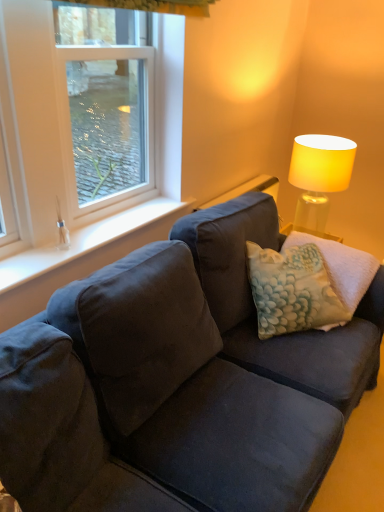
Question: Can you confirm if matte yellow fabric lampshade at upper right is positioned to the right of textured cream pillow at center?

Choices:
 (A) no
 (B) yes

Answer: (B)

Question: Are matte yellow fabric lampshade at upper right and textured cream pillow at center located far from each other?

Choices:
 (A) no
 (B) yes

Answer: (A)

Question: From the image's perspective, is matte yellow fabric lampshade at upper right beneath textured cream pillow at center?

Choices:
 (A) yes
 (B) no

Answer: (B)

Question: Is matte yellow fabric lampshade at upper right in contact with textured cream pillow at center?

Choices:
 (A) no
 (B) yes

Answer: (A)

Question: Does matte yellow fabric lampshade at upper right have a greater width compared to textured cream pillow at center?

Choices:
 (A) no
 (B) yes

Answer: (A)

Question: From the image's perspective, relative to white plastic window at upper left, is silky white curtain at upper center above or below?

Choices:
 (A) below
 (B) above

Answer: (B)

Question: Does point (119, 4) appear closer or farther from the camera than point (124, 212)?

Choices:
 (A) farther
 (B) closer

Answer: (B)

Question: Is silky white curtain at upper center to the left or to the right of white plastic window at upper left in the image?

Choices:
 (A) left
 (B) right

Answer: (B)

Question: From a real-world perspective, is silky white curtain at upper center above or below white plastic window at upper left?

Choices:
 (A) above
 (B) below

Answer: (A)

Question: Is silky white curtain at upper center taller or shorter than white smooth window sill at lower left?

Choices:
 (A) short
 (B) tall

Answer: (B)

Question: Considering the positions of silky white curtain at upper center and white smooth window sill at lower left in the image, is silky white curtain at upper center wider or thinner than white smooth window sill at lower left?

Choices:
 (A) wide
 (B) thin

Answer: (A)

Question: In the image, is silky white curtain at upper center positioned in front of or behind white smooth window sill at lower left?

Choices:
 (A) behind
 (B) front

Answer: (B)

Question: Would you say silky white curtain at upper center is to the left or to the right of white smooth window sill at lower left in the picture?

Choices:
 (A) left
 (B) right

Answer: (B)

Question: From the image's perspective, is white plastic window at upper left positioned above or below matte yellow fabric lampshade at upper right?

Choices:
 (A) above
 (B) below

Answer: (A)

Question: Is white plastic window at upper left wider or thinner than matte yellow fabric lampshade at upper right?

Choices:
 (A) wide
 (B) thin

Answer: (B)